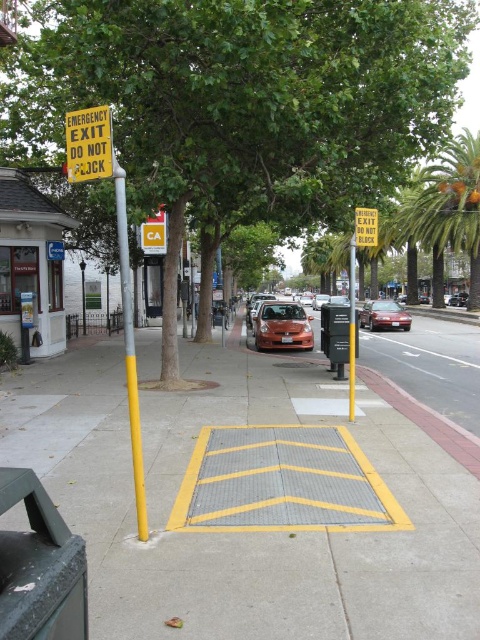
You are standing at the camera position and want to reach point (x=79, y=179). Can you walk directly to it without crossing the tactile paving strip marked by yellow arrows?

The distance between point (x=79, y=179) and the camera is 13.54 feet. However, the question of whether you can walk directly to it without crossing the tactile paving strip requires knowing the path between them. Since the scene description mentions the tactile paving strip is in the foreground with yellow arrows indicating a pedestrian crossing, and the point is at coordinates (x=79, y=179), it is possible that the path to this point may require crossing the tactile paving. Without exact coordinates of the

You are a pedestrian standing on the sidewalk looking towards the street. You see a yellow metallic pole at left and a shiny red car at center. Which object is closer to your left side?

The yellow metallic pole at left is closer to your left side because it is positioned to the left of the shiny red car at center.

You are a pedestrian standing on the sidewalk and want to walk to the bus stop located behind the shiny red car at center. The yellow metallic pole at left is blocking your path. Can you go around it to reach the bus stop?

The yellow metallic pole at left is in front of the shiny red car at center, so you can go around the yellow metallic pole at left to reach the bus stop behind the shiny red car at center.